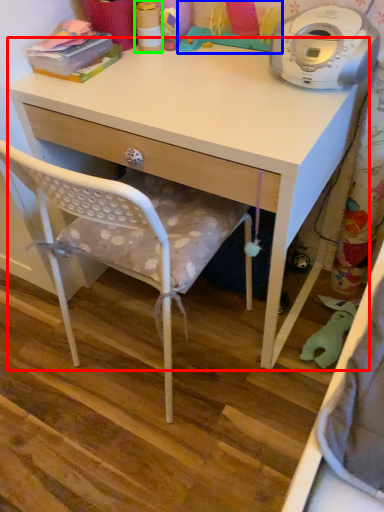
Question: Which is nearer to the desk (highlighted by a red box)? toy (highlighted by a blue box) or toy (highlighted by a green box).

Choices:
 (A) toy
 (B) toy

Answer: (A)